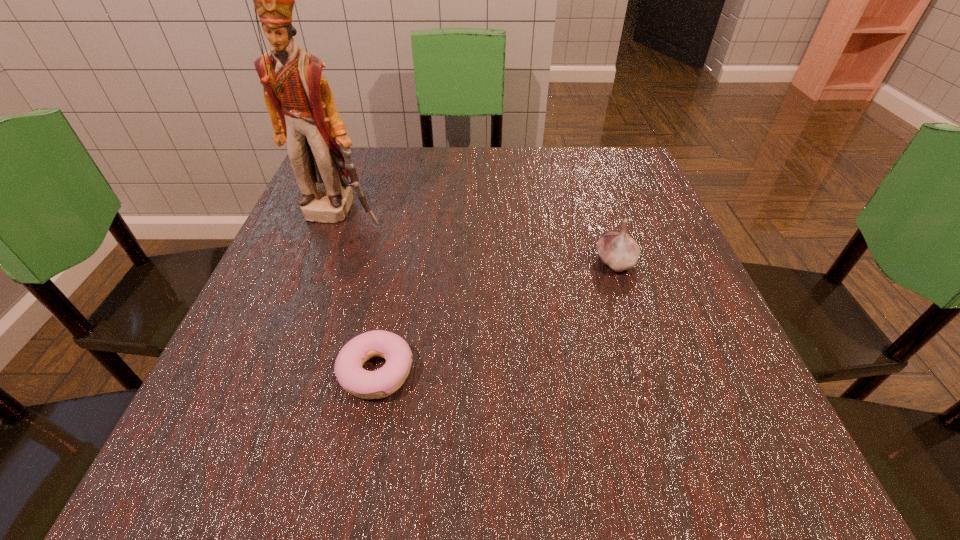
Where is `nutcracker`? nutcracker is located at coordinates (302, 109).

This screenshot has height=540, width=960. What are the coordinates of `the tallest object` in the screenshot? It's located at (302, 109).

Where is `the second nearest object`? This screenshot has width=960, height=540. the second nearest object is located at coordinates (619, 251).

The image size is (960, 540). In order to click on garlic in this screenshot , I will do `click(619, 251)`.

Where is `doughnut`? doughnut is located at coordinates (381, 383).

You are a GUI agent. You are given a task and a screenshot of the screen. Output one action in this format:
    pyautogui.click(x=<x>, y=<y>)
    Task: Click on the shortest object
    This screenshot has height=540, width=960.
    Given the screenshot: What is the action you would take?
    pyautogui.click(x=381, y=383)

Locate an element on the screen. Image resolution: width=960 pixels, height=540 pixels. blank space located 0.200m on the front-facing side of the farthest object is located at coordinates (305, 303).

This screenshot has height=540, width=960. Identify the location of free spot located on the left of the rightmost object. (445, 262).

Locate an element on the screen. This screenshot has width=960, height=540. vacant space located on the back of the doughnut is located at coordinates (403, 238).

At what (x,y) coordinates should I click in order to perform the action: click on object located at the far edge. Please return your answer as a coordinate pair (x, y). This screenshot has height=540, width=960. Looking at the image, I should click on (302, 109).